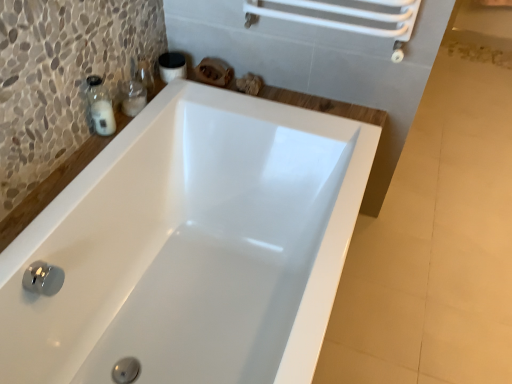
Find the location of a particular element. Image resolution: width=512 pixels, height=384 pixels. white glossy bathtub at center is located at coordinates (192, 247).

Describe the element at coordinates (192, 247) in the screenshot. Image resolution: width=512 pixels, height=384 pixels. I see `white glossy bathtub at center` at that location.

Image resolution: width=512 pixels, height=384 pixels. Describe the element at coordinates (100, 107) in the screenshot. I see `transparent glass soap dispenser at upper left` at that location.

Locate an element on the screen. transparent glass soap dispenser at upper left is located at coordinates (100, 107).

The width and height of the screenshot is (512, 384). What are the coordinates of `white glossy bathtub at center` in the screenshot? It's located at (192, 247).

Is white glossy bathtub at center at the left side of transparent glass soap dispenser at upper left?

No, white glossy bathtub at center is not to the left of transparent glass soap dispenser at upper left.

Considering the relative positions of white glossy bathtub at center and transparent glass soap dispenser at upper left in the image provided, is white glossy bathtub at center behind transparent glass soap dispenser at upper left?

No.

Which is behind, point (30, 247) or point (106, 128)?

The point (106, 128) is more distant.

From the image's perspective, which is below, white glossy bathtub at center or transparent glass soap dispenser at upper left?

From the image's view, white glossy bathtub at center is below.

From a real-world perspective, between white glossy bathtub at center and transparent glass soap dispenser at upper left, who is vertically lower?

white glossy bathtub at center, from a real-world perspective.

Which of these two, white glossy bathtub at center or transparent glass soap dispenser at upper left, is wider?

white glossy bathtub at center is wider.

Does white glossy bathtub at center have a greater height compared to transparent glass soap dispenser at upper left?

Correct, white glossy bathtub at center is much taller as transparent glass soap dispenser at upper left.

Between white glossy bathtub at center and transparent glass soap dispenser at upper left, which one has larger size?

white glossy bathtub at center is bigger.

Is transparent glass soap dispenser at upper left inside white glossy bathtub at center?

No.

Can you see white glossy bathtub at center touching transparent glass soap dispenser at upper left?

No, white glossy bathtub at center is not touching transparent glass soap dispenser at upper left.

Is white glossy bathtub at center aimed at transparent glass soap dispenser at upper left?

No, white glossy bathtub at center is not facing towards transparent glass soap dispenser at upper left.

You are a GUI agent. You are given a task and a screenshot of the screen. Output one action in this format:
    pyautogui.click(x=<x>, y=<y>)
    Task: Click on the soap dispenser that is on the left side of white glossy bathtub at center
    
    Given the screenshot: What is the action you would take?
    pyautogui.click(x=100, y=107)

Does transparent glass soap dispenser at upper left appear on the right side of white glossy bathtub at center?

No, transparent glass soap dispenser at upper left is not to the right of white glossy bathtub at center.

Which object is further away from the camera taking this photo, transparent glass soap dispenser at upper left or white glossy bathtub at center?

transparent glass soap dispenser at upper left is further from the camera.

Considering the positions of point (106, 120) and point (162, 296), is point (106, 120) closer or farther from the camera than point (162, 296)?

Point (106, 120) is positioned closer to the camera compared to point (162, 296).

From the image's perspective, is transparent glass soap dispenser at upper left positioned above or below white glossy bathtub at center?

From the image's perspective, transparent glass soap dispenser at upper left appears above white glossy bathtub at center.

From a real-world perspective, is transparent glass soap dispenser at upper left physically located above or below white glossy bathtub at center?

In terms of real-world spatial position, transparent glass soap dispenser at upper left is above white glossy bathtub at center.

Does transparent glass soap dispenser at upper left have a lesser width compared to white glossy bathtub at center?

Correct, the width of transparent glass soap dispenser at upper left is less than that of white glossy bathtub at center.

Consider the image. Considering the relative sizes of transparent glass soap dispenser at upper left and white glossy bathtub at center in the image provided, is transparent glass soap dispenser at upper left shorter than white glossy bathtub at center?

Yes, transparent glass soap dispenser at upper left is shorter than white glossy bathtub at center.

Can you confirm if transparent glass soap dispenser at upper left is bigger than white glossy bathtub at center?

Incorrect, transparent glass soap dispenser at upper left is not larger than white glossy bathtub at center.

Is transparent glass soap dispenser at upper left situated inside white glossy bathtub at center or outside?

transparent glass soap dispenser at upper left is not inside white glossy bathtub at center, it's outside.

Is transparent glass soap dispenser at upper left next to white glossy bathtub at center?

No, transparent glass soap dispenser at upper left is not making contact with white glossy bathtub at center.

Does transparent glass soap dispenser at upper left turn towards white glossy bathtub at center?

No, transparent glass soap dispenser at upper left is not facing towards white glossy bathtub at center.

Can you tell me how much transparent glass soap dispenser at upper left and white glossy bathtub at center differ in facing direction?

6.5 degrees separate the facing orientations of transparent glass soap dispenser at upper left and white glossy bathtub at center.

Measure the distance between transparent glass soap dispenser at upper left and white glossy bathtub at center.

The distance of transparent glass soap dispenser at upper left from white glossy bathtub at center is 51.34 centimeters.

The image size is (512, 384). In the image, there is a transparent glass soap dispenser at upper left. Find the location of `bathtub below it (from the image's perspective)`. bathtub below it (from the image's perspective) is located at coordinates (192, 247).

You are a GUI agent. You are given a task and a screenshot of the screen. Output one action in this format:
    pyautogui.click(x=<x>, y=<y>)
    Task: Click on the bathtub in front of the transparent glass soap dispenser at upper left
    This screenshot has width=512, height=384.
    Given the screenshot: What is the action you would take?
    pyautogui.click(x=192, y=247)

Identify the location of bathtub that appears on the right of transparent glass soap dispenser at upper left. The width and height of the screenshot is (512, 384). (192, 247).